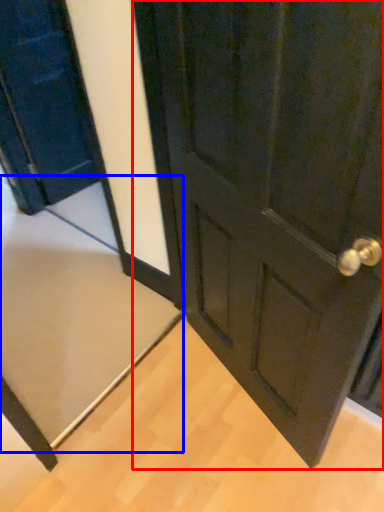
Question: Which of the following is the closest to the observer, door (highlighted by a red box) or doormat (highlighted by a blue box)?

Choices:
 (A) door
 (B) doormat

Answer: (A)